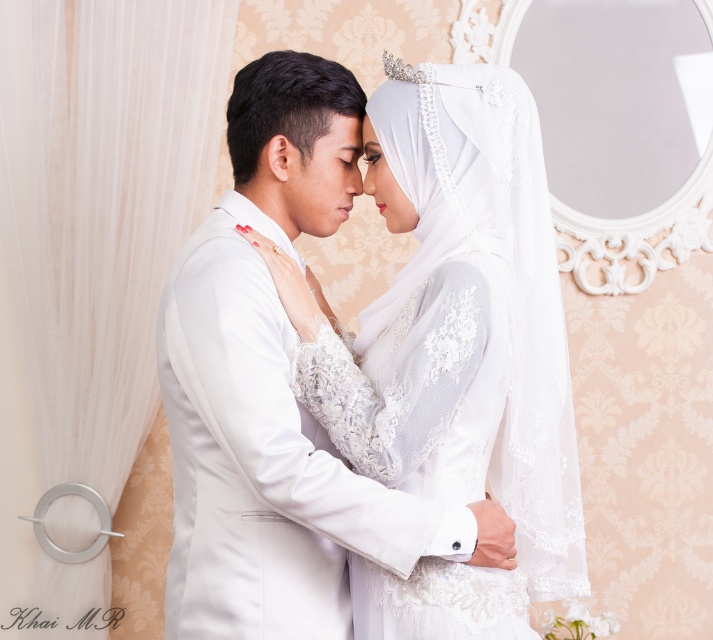
Does lace fabric dress at center come in front of matte white forehead at center?

Yes, lace fabric dress at center is in front of matte white forehead at center.

Is lace fabric dress at center taller than matte white forehead at center?

Yes.

Is point (384, 465) in front of point (349, 115)?

Yes, it is.

This screenshot has height=640, width=713. Find the location of `lace fabric dress at center`. lace fabric dress at center is located at coordinates (416, 388).

Does white lace dress at center have a smaller size compared to matte white forehead at center?

No, white lace dress at center is not smaller than matte white forehead at center.

Does white lace dress at center have a larger size compared to matte white forehead at center?

Yes, white lace dress at center is bigger than matte white forehead at center.

Describe the element at coordinates (453, 352) in the screenshot. I see `white lace dress at center` at that location.

This screenshot has width=713, height=640. Find the location of `white lace dress at center`. white lace dress at center is located at coordinates (453, 352).

Is white lace dress at center above lace fabric dress at center?

Yes.

Between point (429, 621) and point (461, 337), which one is positioned in front?

Positioned in front is point (461, 337).

You are a GUI agent. You are given a task and a screenshot of the screen. Output one action in this format:
    pyautogui.click(x=<x>, y=<y>)
    Task: Click on the white lace dress at center
    The height and width of the screenshot is (640, 713).
    Given the screenshot: What is the action you would take?
    pyautogui.click(x=453, y=352)